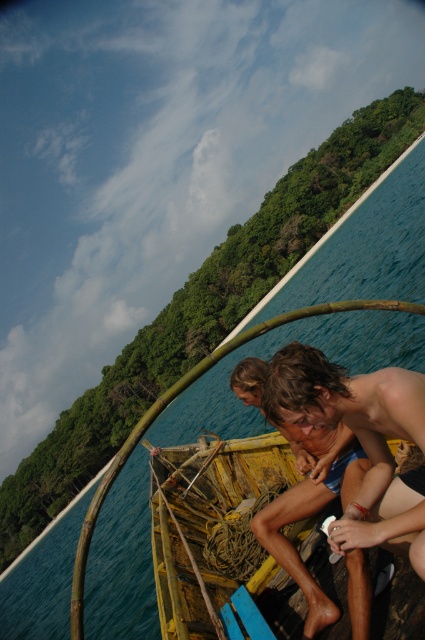
You are standing on the dock and looking at the yellow weathered wood boat at center and the shiny brown hair at center. Which object is closer to you?

The yellow weathered wood boat at center is closer to you because it is positioned under the shiny brown hair at center, indicating it is lower in the visual hierarchy.

You are a photographer trying to capture the scene of the yellow weathered wood boat at center and the shiny brown hair at center. Since you want to emphasize the boat in your photo, should you use a wide angle lens or a telephoto lens?

Since the yellow weathered wood boat at center is larger in size compared to the shiny brown hair at center, using a wide angle lens would help emphasize the boat by capturing more of its structure and details in the frame.

You are standing on a dock and looking at the boat in the image. There is a point at coordinates point (311, 531) that you need to reach. If your arm can extend 5 meters, can you reach that point?

The distance between point (311, 531) and the camera is 4.99 meters. Since your arm can extend 5 meters, you can just barely reach the point.